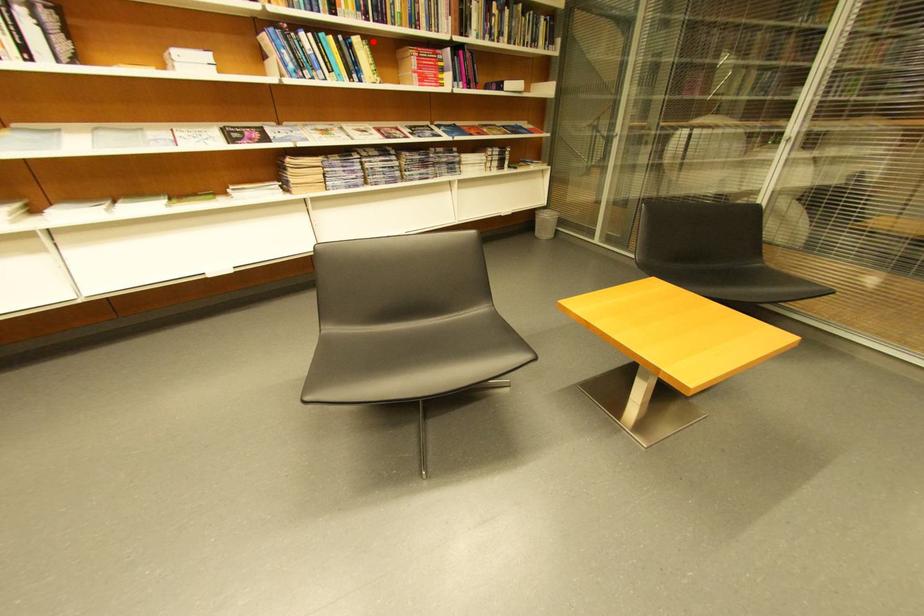
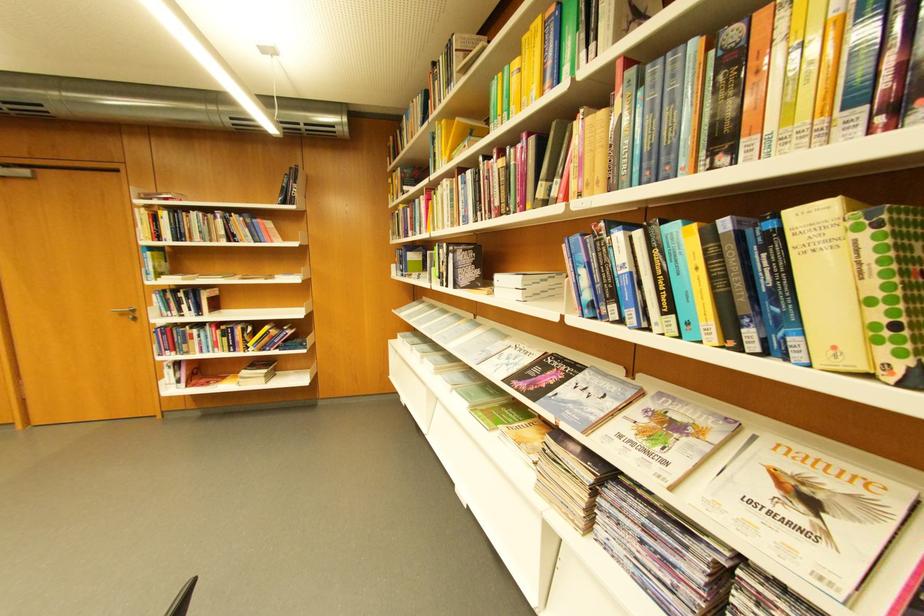
Locate, in the second image, the point that corresponds to the highlighted location in the first image.

(861, 209)